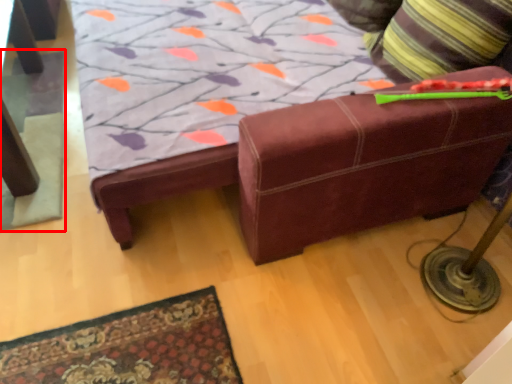
Question: From the image's perspective, where is mat (annotated by the red box) located relative to throw pillow?

Choices:
 (A) above
 (B) below

Answer: (B)